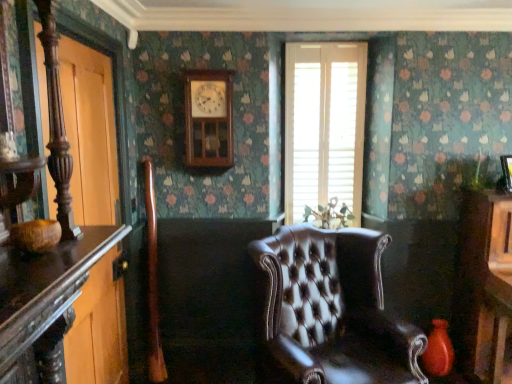
Question: From the image's perspective, is brown leather chair at center on white wood blinds at center?

Choices:
 (A) yes
 (B) no

Answer: (B)

Question: From the image's perspective, is brown leather chair at center beneath white wood blinds at center?

Choices:
 (A) no
 (B) yes

Answer: (B)

Question: Can you confirm if brown leather chair at center is smaller than white wood blinds at center?

Choices:
 (A) yes
 (B) no

Answer: (B)

Question: From a real-world perspective, is brown leather chair at center under white wood blinds at center?

Choices:
 (A) yes
 (B) no

Answer: (A)

Question: Considering the relative sizes of brown leather chair at center and white wood blinds at center in the image provided, is brown leather chair at center shorter than white wood blinds at center?

Choices:
 (A) yes
 (B) no

Answer: (A)

Question: From a real-world perspective, is brown leather chair at center physically located above or below white wood blinds at center?

Choices:
 (A) below
 (B) above

Answer: (A)

Question: Is point (304, 380) closer or farther from the camera than point (352, 201)?

Choices:
 (A) farther
 (B) closer

Answer: (B)

Question: Is brown leather chair at center bigger or smaller than white wood blinds at center?

Choices:
 (A) small
 (B) big

Answer: (B)

Question: From the image's perspective, is brown leather chair at center located above or below white wood blinds at center?

Choices:
 (A) above
 (B) below

Answer: (B)

Question: Is matte red vase at lower right taller or shorter than green glossy plant at center?

Choices:
 (A) short
 (B) tall

Answer: (B)

Question: From a real-world perspective, is matte red vase at lower right above or below green glossy plant at center?

Choices:
 (A) below
 (B) above

Answer: (A)

Question: Do you think matte red vase at lower right is within green glossy plant at center, or outside of it?

Choices:
 (A) inside
 (B) outside

Answer: (B)

Question: Relative to green glossy plant at center, is matte red vase at lower right in front or behind?

Choices:
 (A) front
 (B) behind

Answer: (A)

Question: Is white wood blinds at center to the left or to the right of brown leather chair at center in the image?

Choices:
 (A) left
 (B) right

Answer: (B)

Question: Is point (296, 187) closer or farther from the camera than point (416, 329)?

Choices:
 (A) closer
 (B) farther

Answer: (B)